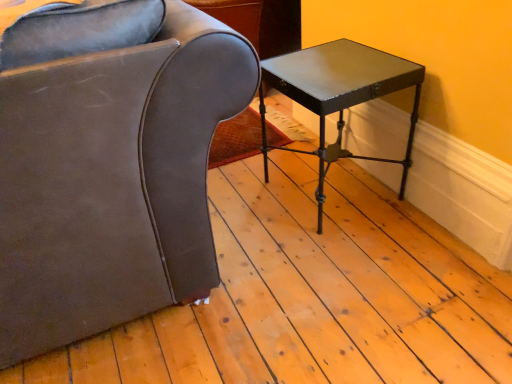
Locate an element on the screen. free spot below glossy black table at right (from a real-world perspective) is located at coordinates (333, 186).